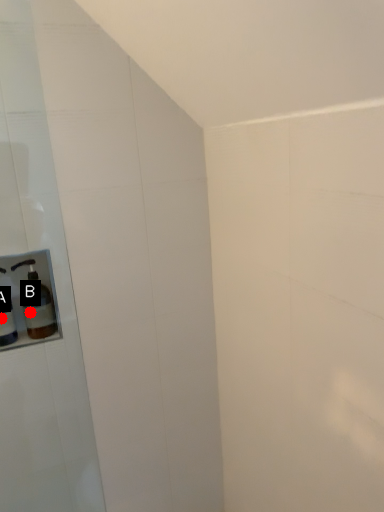
Question: Two points are circled on the image, labeled by A and B beside each circle. Among these points, which one is farthest from the camera?

Choices:
 (A) A is further
 (B) B is further

Answer: (B)